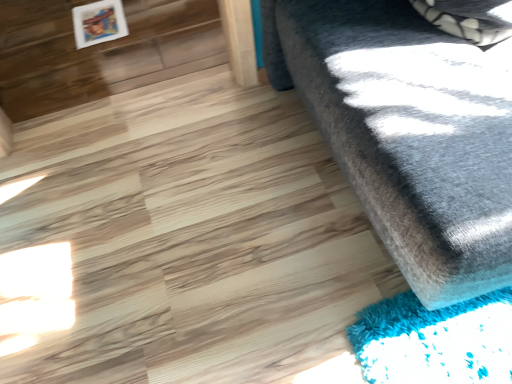
Find the location of a particular element. fuzzy gray ottoman at right is located at coordinates (409, 132).

Describe the element at coordinates (409, 132) in the screenshot. The height and width of the screenshot is (384, 512). I see `fuzzy gray ottoman at right` at that location.

The image size is (512, 384). Find the location of `fuzzy gray ottoman at right`. fuzzy gray ottoman at right is located at coordinates (409, 132).